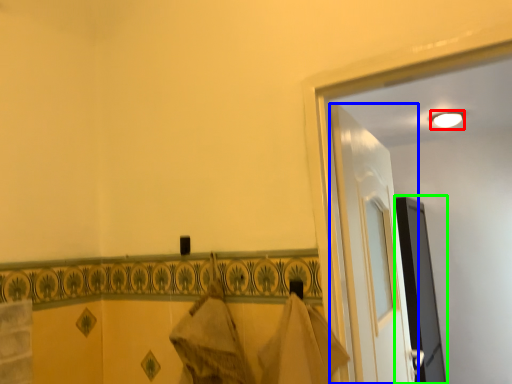
Question: Which is nearer to the light (highlighted by a red box)? door (highlighted by a blue box) or screen door (highlighted by a green box).

Choices:
 (A) door
 (B) screen door

Answer: (B)